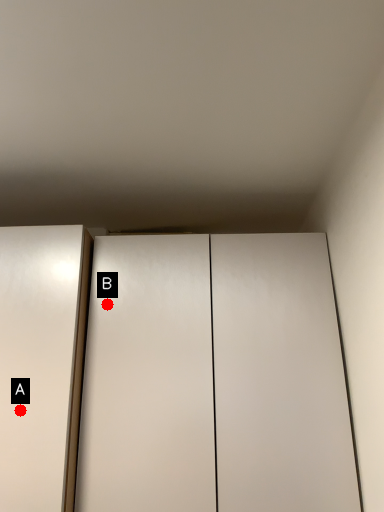
Question: Two points are circled on the image, labeled by A and B beside each circle. Among these points, which one is nearest to the camera?

Choices:
 (A) A is closer
 (B) B is closer

Answer: (A)